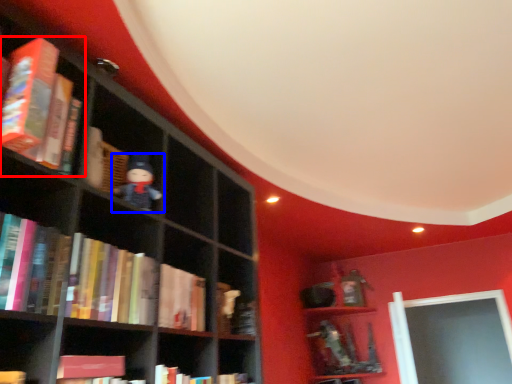
Question: Which point is further to the camera, book (highlighted by a red box) or toy (highlighted by a blue box)?

Choices:
 (A) book
 (B) toy

Answer: (B)